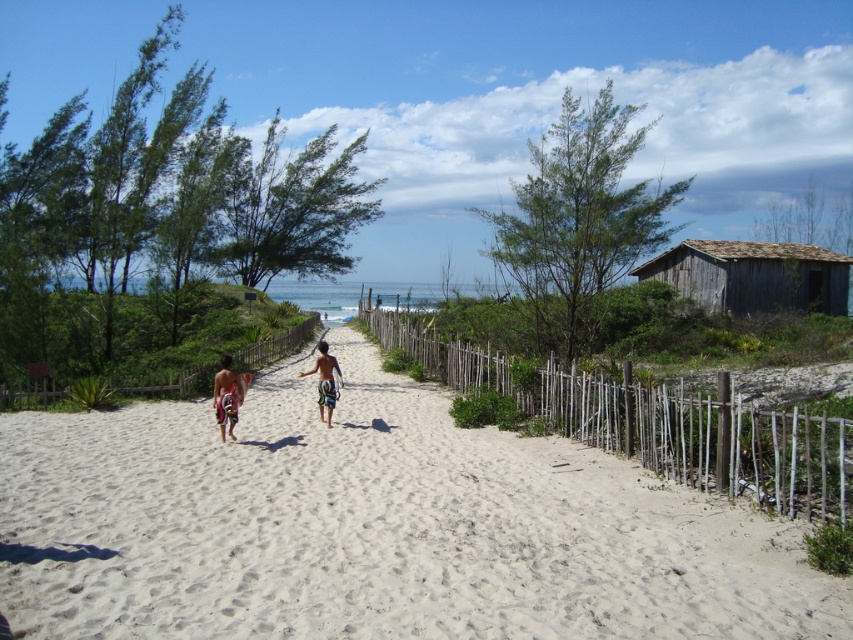
Based on the photo, between wooden at right and multicolored striped shorts at center, which one appears on the right side from the viewer's perspective?

wooden at right

The height and width of the screenshot is (640, 853). Identify the location of wooden at right. (653, 422).

Where is `wooden at right`? Image resolution: width=853 pixels, height=640 pixels. wooden at right is located at coordinates (653, 422).

Is wooden at right closer to the viewer compared to multicolored board shorts at center?

Yes, it is.

Does wooden at right have a larger size compared to multicolored board shorts at center?

Correct, wooden at right is larger in size than multicolored board shorts at center.

Which is behind, point (664, 426) or point (228, 392)?

Positioned behind is point (228, 392).

You are a GUI agent. You are given a task and a screenshot of the screen. Output one action in this format:
    pyautogui.click(x=<x>, y=<y>)
    Task: Click on the wooden at right
    This screenshot has width=853, height=640.
    Given the screenshot: What is the action you would take?
    pyautogui.click(x=653, y=422)

Measure the distance between multicolored swim trunks at center and multicolored striped shorts at center.

76.85 centimeters

Can you confirm if multicolored swim trunks at center is positioned to the right of multicolored striped shorts at center?

In fact, multicolored swim trunks at center is to the left of multicolored striped shorts at center.

You are a GUI agent. You are given a task and a screenshot of the screen. Output one action in this format:
    pyautogui.click(x=<x>, y=<y>)
    Task: Click on the multicolored swim trunks at center
    
    Given the screenshot: What is the action you would take?
    pyautogui.click(x=228, y=396)

Identify the location of multicolored swim trunks at center. This screenshot has width=853, height=640. (228, 396).